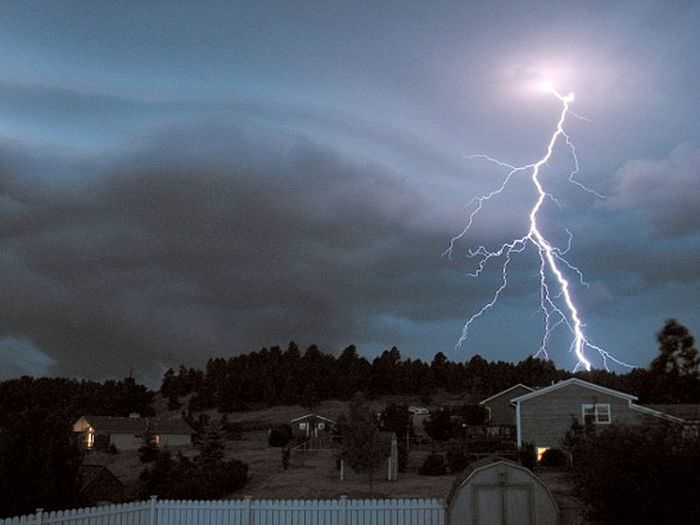
Locate an element on the screen. This screenshot has height=525, width=700. lights is located at coordinates (88, 430).